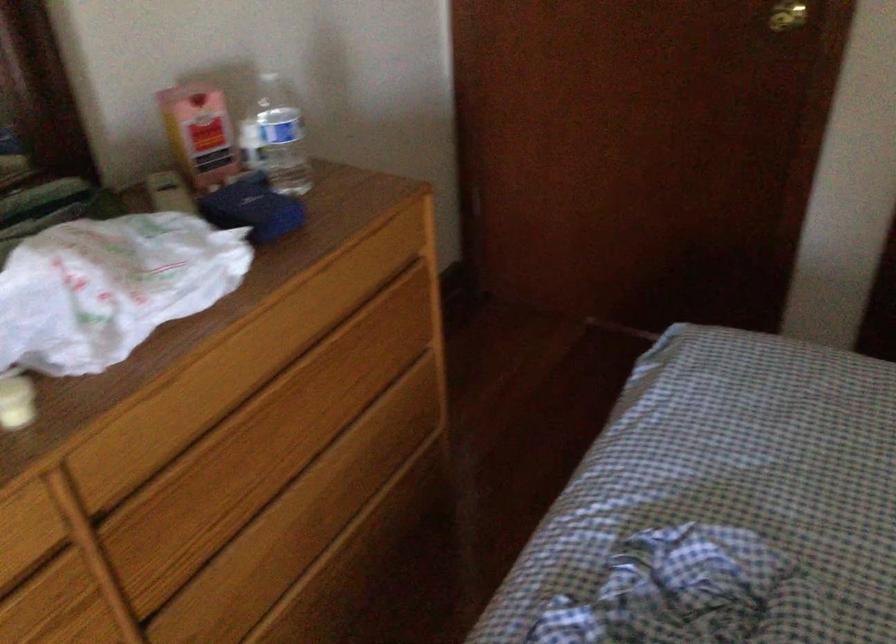
Where is `pink cardboard box`? pink cardboard box is located at coordinates (200, 134).